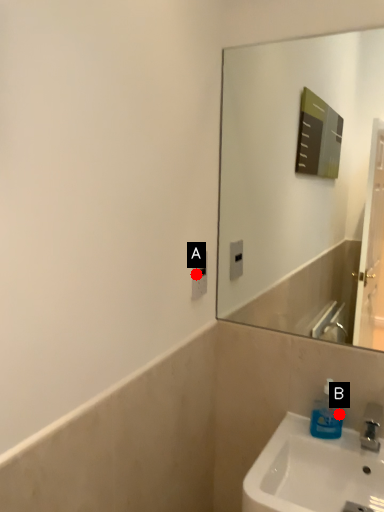
Question: Two points are circled on the image, labeled by A and B beside each circle. Which point is closer to the camera taking this photo?

Choices:
 (A) A is closer
 (B) B is closer

Answer: (B)